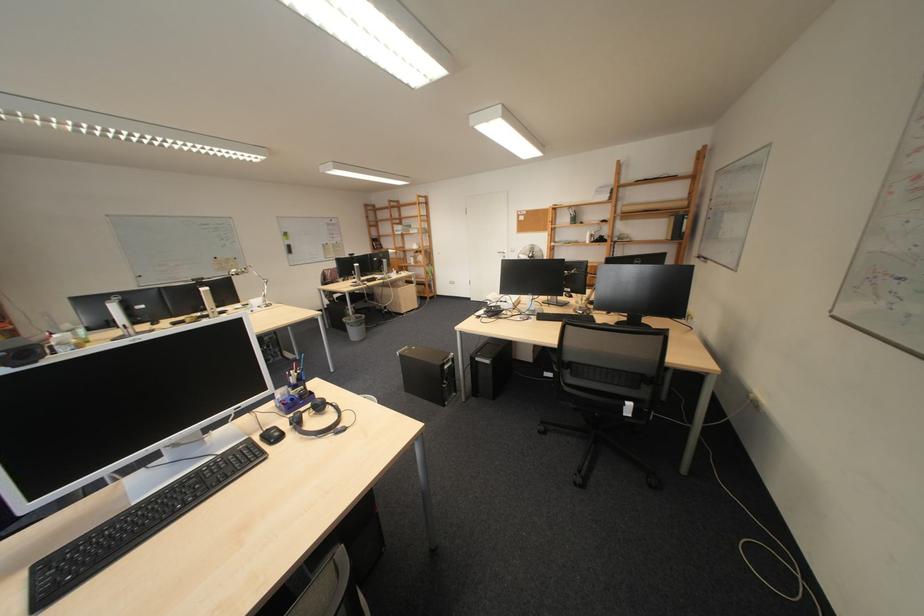
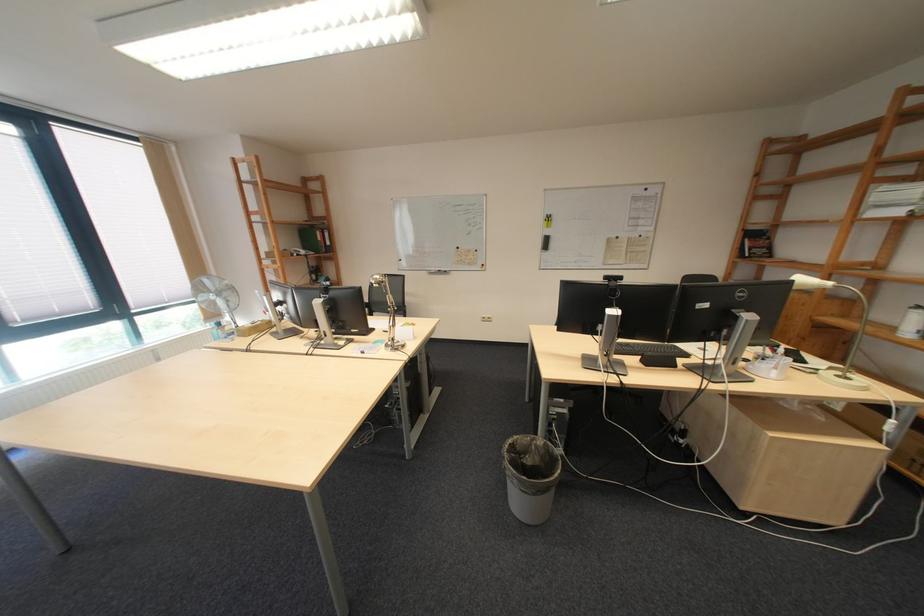
In the second image, find the point that corresponds to (x=359, y=320) in the first image.

(529, 439)